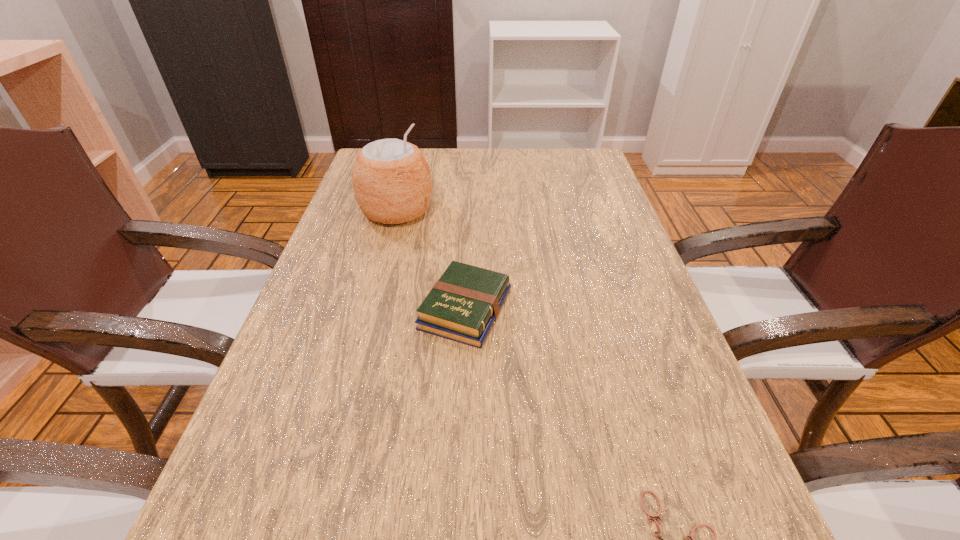
You are a GUI agent. You are given a task and a screenshot of the screen. Output one action in this format:
    pyautogui.click(x=<x>, y=<y>)
    Task: Click on the coconut
    The image size is (960, 540).
    Given the screenshot: What is the action you would take?
    pyautogui.click(x=392, y=184)

This screenshot has height=540, width=960. I want to click on the tallest object, so click(392, 184).

At what (x,y) coordinates should I click in order to perform the action: click on book. Please return your answer as a coordinate pair (x, y). Looking at the image, I should click on (462, 306).

Find the location of a particular element. the third nearest object is located at coordinates (462, 306).

Image resolution: width=960 pixels, height=540 pixels. I want to click on vacant space situated on the front of the farthest object, so click(385, 258).

The width and height of the screenshot is (960, 540). What are the coordinates of `vacant space located on the front of the book` in the screenshot? It's located at (461, 435).

In order to click on object located in the left edge section of the desktop in this screenshot , I will do `click(392, 184)`.

You are a GUI agent. You are given a task and a screenshot of the screen. Output one action in this format:
    pyautogui.click(x=<x>, y=<y>)
    Task: Click on the vacant area at the far edge
    
    Given the screenshot: What is the action you would take?
    pyautogui.click(x=456, y=177)

The image size is (960, 540). In the image, there is a desktop. What are the coordinates of `vacant space at the left edge` in the screenshot? It's located at (361, 347).

In order to click on free space at the right edge of the desktop in this screenshot , I will do `click(587, 198)`.